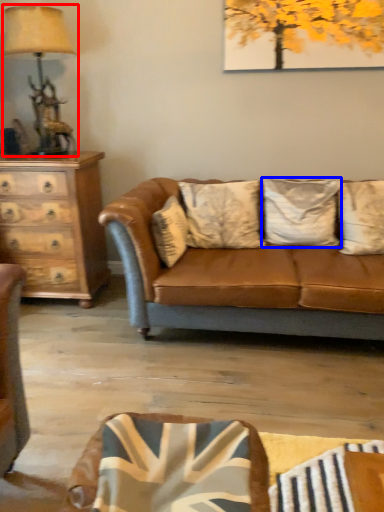
Question: Which of the following is the closest to the observer, table lamp (highlighted by a red box) or pillow (highlighted by a blue box)?

Choices:
 (A) table lamp
 (B) pillow

Answer: (A)